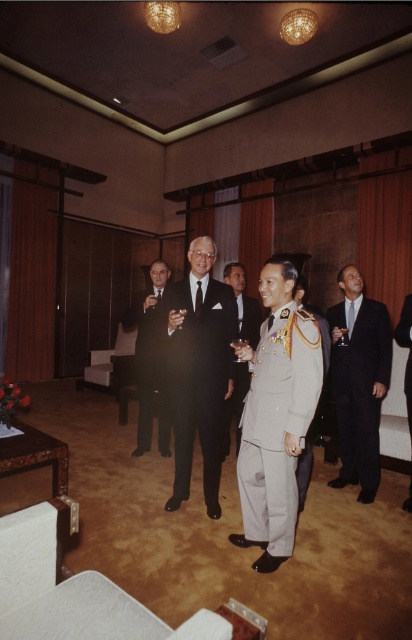
Can you confirm if black satin suit at center is bigger than shiny black suit at center?

Incorrect, black satin suit at center is not larger than shiny black suit at center.

Does point (337, 353) come behind point (145, 397)?

No, (337, 353) is in front of (145, 397).

Does point (369, 365) lie in front of point (156, 289)?

Yes, it is.

Locate an element on the screen. This screenshot has width=412, height=640. black satin suit at center is located at coordinates (358, 380).

Is shiny black suit at center further to camera compared to light beige suit at center?

Yes.

Can you confirm if shiny black suit at center is positioned above light beige suit at center?

Yes.

I want to click on shiny black suit at center, so tap(149, 362).

The height and width of the screenshot is (640, 412). In order to click on shiny black suit at center in this screenshot , I will do `click(149, 362)`.

Find the location of `matte black suit at center`. matte black suit at center is located at coordinates pos(198,369).

Which is more to the right, matte black suit at center or black leather shoes at center?

From the viewer's perspective, black leather shoes at center appears more on the right side.

What do you see at coordinates (198, 369) in the screenshot? The image size is (412, 640). I see `matte black suit at center` at bounding box center [198, 369].

Where is `matte black suit at center`? matte black suit at center is located at coordinates (198, 369).